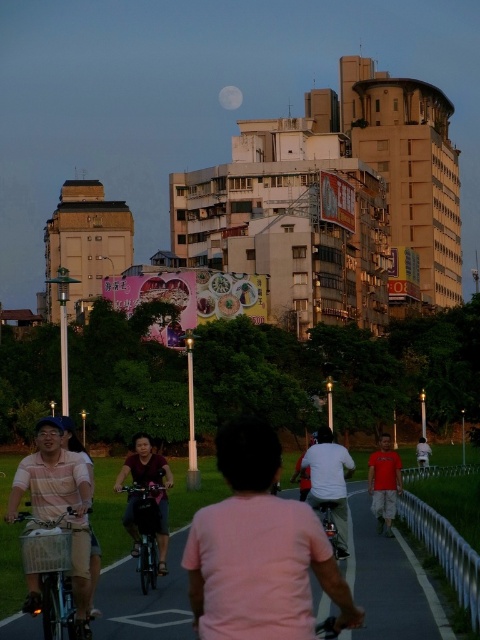
Question: Which is nearer to the shiny metallic bicycle at center?

Choices:
 (A) silver metallic bicycle at center-left
 (B) pink fabric shirt at center

Answer: (A)

Question: Observing the image, what is the correct spatial positioning of shiny metallic bicycle at center in reference to white matte moon at upper center?

Choices:
 (A) right
 (B) left

Answer: (A)

Question: Which object is farther from the camera taking this photo?

Choices:
 (A) white cotton shirt at center
 (B) shiny black bicycle at center
 (C) shiny metallic bicycle at center

Answer: (A)

Question: Can you confirm if pink fabric shirt at center is bigger than white matte moon at upper center?

Choices:
 (A) yes
 (B) no

Answer: (A)

Question: Which of the following is the closest to the observer?

Choices:
 (A) (321, 518)
 (B) (375, 477)
 (C) (316, 477)

Answer: (A)

Question: Is pink fabric shirt at center to the left of shiny metallic bicycle at center from the viewer's perspective?

Choices:
 (A) yes
 (B) no

Answer: (A)